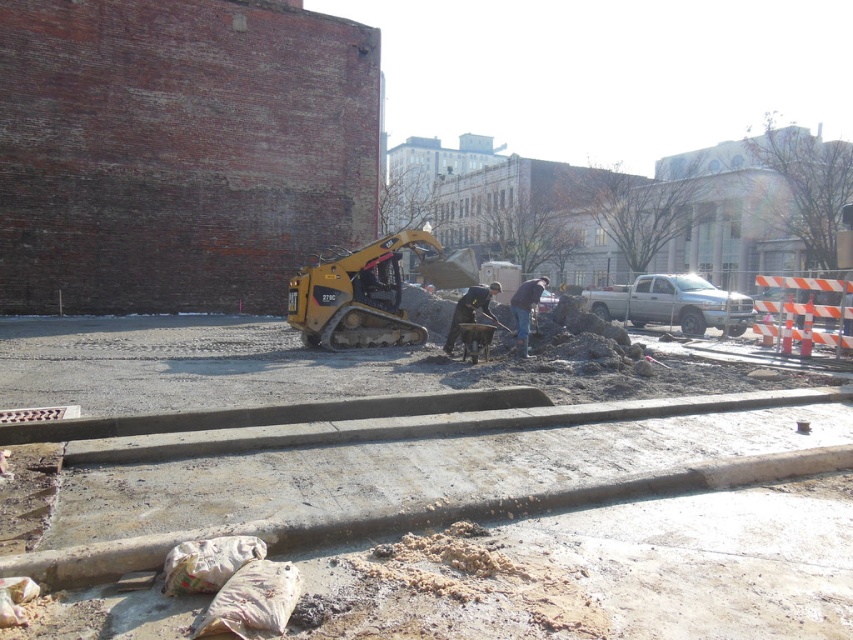
You are a construction worker standing at the edge of the sidewalk and need to place two markers at the coordinates point (x=811, y=488) and point (x=521, y=323). Which marker will be closer to your current position?

The point (x=811, y=488) is closer to the camera than point (x=521, y=323), so the marker at point (x=811, y=488) will be closer to your current position.

You are a safety inspector at the construction site and need to ensure that the dark gray uniform at center and the dark blue jeans at center are not too close to the yellow compact track loader. Which worker is wearing clothing with a smaller width that might be less likely to get caught in machinery?

The dark gray uniform at center has a lesser width compared to the dark blue jeans at center, so the worker wearing the dark gray uniform at center has clothing with a smaller width and is less likely to get caught in machinery.

You are a delivery person trying to navigate through the construction site. You see the matte concrete sidewalk at center and the dark blue jeans at center. Which path can you take that is narrower?

The matte concrete sidewalk at center is smaller than dark blue jeans at center, so the path through the matte concrete sidewalk at center is narrower and suitable for navigation.